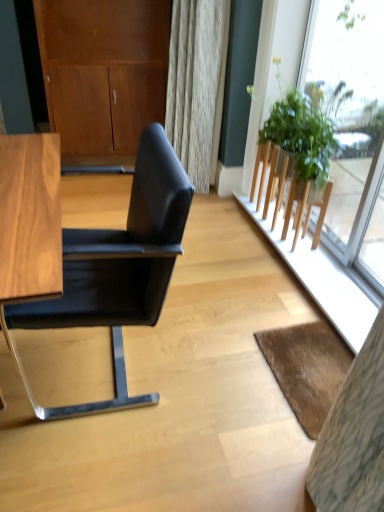
The width and height of the screenshot is (384, 512). In order to click on brown textured mat at lower right in this screenshot , I will do `click(307, 369)`.

This screenshot has height=512, width=384. What do you see at coordinates (103, 71) in the screenshot?
I see `matte wood dresser at upper left` at bounding box center [103, 71].

Find the location of a particular element. black leather chair at left is located at coordinates (117, 269).

What is the approximate width of transparent glass window at upper right?

It is 1.27 inches.

Image resolution: width=384 pixels, height=512 pixels. Describe the element at coordinates (351, 125) in the screenshot. I see `transparent glass window at upper right` at that location.

The height and width of the screenshot is (512, 384). In order to click on brown textured mat at lower right in this screenshot , I will do `click(307, 369)`.

From the image's perspective, would you say green leafy plant at right is shown under matte wood dresser at upper left?

Indeed, from the image's perspective, green leafy plant at right is shown beneath matte wood dresser at upper left.

Which object is more forward, green leafy plant at right or matte wood dresser at upper left?

green leafy plant at right.

Would you say matte wood dresser at upper left is part of green leafy plant at right's contents?

No, matte wood dresser at upper left is not inside green leafy plant at right.

From a real-world perspective, is green leafy plant at right positioned above or below matte wood dresser at upper left?

From a real-world perspective, green leafy plant at right is physically below matte wood dresser at upper left.

Which object is wider, brown textured mat at lower right or green leafy plant at right?

brown textured mat at lower right.

Does brown textured mat at lower right have a smaller size compared to green leafy plant at right?

Indeed, brown textured mat at lower right has a smaller size compared to green leafy plant at right.

Would you say brown textured mat at lower right is inside or outside green leafy plant at right?

brown textured mat at lower right cannot be found inside green leafy plant at right.

Is brown textured mat at lower right taller than green leafy plant at right?

Incorrect, the height of brown textured mat at lower right is not larger of that of green leafy plant at right.

From their relative heights in the image, would you say green leafy plant at right is taller or shorter than black leather chair at left?

In the image, green leafy plant at right appears to be shorter than black leather chair at left.

Is green leafy plant at right next to black leather chair at left and touching it?

They are not placed beside each other.

Locate an element on the screen. The width and height of the screenshot is (384, 512). chair below the green leafy plant at right (from a real-world perspective) is located at coordinates (117, 269).

Could you tell me if green leafy plant at right is turned towards black leather chair at left?

No, green leafy plant at right is not oriented towards black leather chair at left.

Considering the sizes of objects matte wood dresser at upper left and transparent glass window at upper right in the image provided, who is smaller, matte wood dresser at upper left or transparent glass window at upper right?

Smaller between the two is transparent glass window at upper right.

Which of these two, matte wood dresser at upper left or transparent glass window at upper right, is thinner?

transparent glass window at upper right.

How different are the orientations of matte wood dresser at upper left and transparent glass window at upper right in degrees?

matte wood dresser at upper left and transparent glass window at upper right are facing 89.4 degrees away from each other.

Does matte wood dresser at upper left contain transparent glass window at upper right?

No, transparent glass window at upper right is not surrounded by matte wood dresser at upper left.

Is point (267, 203) positioned after point (343, 257)?

Yes.

What's the angular difference between green leafy plant at right and transparent glass window at upper right's facing directions?

green leafy plant at right and transparent glass window at upper right are facing 2.67 degrees away from each other.

Is green leafy plant at right looking in the opposite direction of transparent glass window at upper right?

Yes.

In the image, there is a transparent glass window at upper right. Where is `houseplant below it (from the image's perspective)`? houseplant below it (from the image's perspective) is located at coordinates tap(298, 150).

Considering the sizes of matte wood dresser at upper left and black leather chair at left in the image, is matte wood dresser at upper left bigger or smaller than black leather chair at left?

Considering their sizes, matte wood dresser at upper left takes up more space than black leather chair at left.

How much distance is there between matte wood dresser at upper left and black leather chair at left?

A distance of 1.83 meters exists between matte wood dresser at upper left and black leather chair at left.

Consider the image. Is the position of matte wood dresser at upper left more distant than that of black leather chair at left?

Yes, matte wood dresser at upper left is further from the viewer.

Consider the image. Is matte wood dresser at upper left oriented away from black leather chair at left?

matte wood dresser at upper left does not have its back to black leather chair at left.

Where is `chair in front of the brown textured mat at lower right`? Image resolution: width=384 pixels, height=512 pixels. chair in front of the brown textured mat at lower right is located at coordinates click(117, 269).

Can you tell me how much brown textured mat at lower right and black leather chair at left differ in facing direction?

There is a 0.314-degree angle between the facing directions of brown textured mat at lower right and black leather chair at left.

In the scene shown: Can you confirm if brown textured mat at lower right is shorter than black leather chair at left?

Yes, brown textured mat at lower right is shorter than black leather chair at left.

Which is more to the right, brown textured mat at lower right or black leather chair at left?

brown textured mat at lower right is more to the right.

The height and width of the screenshot is (512, 384). In order to click on dresser on the left of green leafy plant at right in this screenshot , I will do `click(103, 71)`.

You are a GUI agent. You are given a task and a screenshot of the screen. Output one action in this format:
    pyautogui.click(x=<x>, y=<y>)
    Task: Click on the houseplant above the brown textured mat at lower right (from a real-world perspective)
    
    Given the screenshot: What is the action you would take?
    pyautogui.click(x=298, y=150)

Estimate the real-world distances between objects in this image. Which object is further from green leafy plant at right, brown textured mat at lower right or matte wood dresser at upper left?

matte wood dresser at upper left is further to green leafy plant at right.

From the image, which object appears to be farther from matte wood dresser at upper left, brown textured mat at lower right or black leather chair at left?

The object further to matte wood dresser at upper left is brown textured mat at lower right.

From the image, which object appears to be farther from brown textured mat at lower right, matte wood dresser at upper left or green leafy plant at right?

The object further to brown textured mat at lower right is matte wood dresser at upper left.

When comparing their distances from matte wood dresser at upper left, does transparent glass window at upper right or black leather chair at left seem further?

The object further to matte wood dresser at upper left is black leather chair at left.

Which object lies nearer to the anchor point green leafy plant at right, black leather chair at left or matte wood dresser at upper left?

black leather chair at left is positioned closer to the anchor green leafy plant at right.

Which object lies further to the anchor point brown textured mat at lower right, green leafy plant at right or black leather chair at left?

green leafy plant at right lies further to brown textured mat at lower right than the other object.

From the image, which object appears to be nearer to black leather chair at left, matte wood dresser at upper left or brown textured mat at lower right?

Among the two, brown textured mat at lower right is located nearer to black leather chair at left.

From the image, which object appears to be nearer to black leather chair at left, transparent glass window at upper right or green leafy plant at right?

green leafy plant at right.

Find the location of `houseplant between matte wood dresser at upper left and brown textured mat at lower right vertically`. houseplant between matte wood dresser at upper left and brown textured mat at lower right vertically is located at coordinates coord(298,150).

Locate an element on the screen. This screenshot has height=512, width=384. mat between black leather chair at left and green leafy plant at right is located at coordinates (307, 369).

You are a GUI agent. You are given a task and a screenshot of the screen. Output one action in this format:
    pyautogui.click(x=<x>, y=<y>)
    Task: Click on the window between black leather chair at left and matte wood dresser at upper left in the front-back direction
    The height and width of the screenshot is (512, 384).
    Given the screenshot: What is the action you would take?
    pyautogui.click(x=351, y=125)

At what (x,y) coordinates should I click in order to perform the action: click on window between matte wood dresser at upper left and brown textured mat at lower right from top to bottom. Please return your answer as a coordinate pair (x, y). Looking at the image, I should click on coord(351,125).